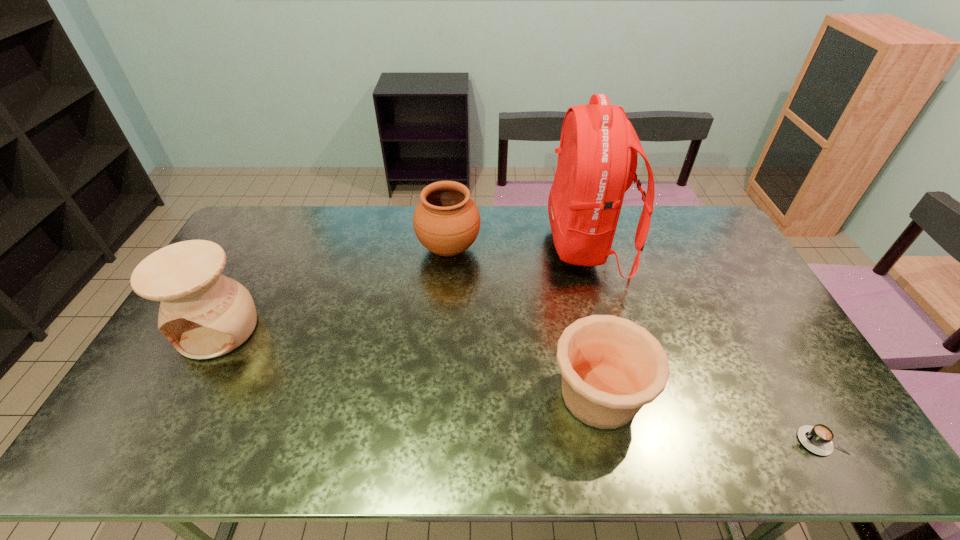
Where is `backpack`? backpack is located at coordinates (597, 157).

I want to click on the leftmost object, so click(x=204, y=314).

Where is `the fourth object from right to left`? the fourth object from right to left is located at coordinates (446, 221).

You are a GUI agent. You are given a task and a screenshot of the screen. Output one action in this format:
    pyautogui.click(x=<x>, y=<y>)
    Task: Click on the second pottery from right to left
    The image size is (960, 540).
    Given the screenshot: What is the action you would take?
    pyautogui.click(x=446, y=221)

Locate an element on the screen. the fourth tallest object is located at coordinates (611, 367).

Locate an element on the screen. The image size is (960, 540). the shortest pottery is located at coordinates (611, 367).

Locate an element on the screen. Image resolution: width=960 pixels, height=540 pixels. the shortest object is located at coordinates (818, 439).

Find the location of a particular element. The image size is (960, 540). cappuccino is located at coordinates (818, 439).

Locate an element on the screen. The image size is (960, 540). vacant space located on the main compartment of the backpack is located at coordinates (487, 246).

The width and height of the screenshot is (960, 540). In order to click on vacant space located on the main compartment of the backpack in this screenshot , I will do `click(487, 246)`.